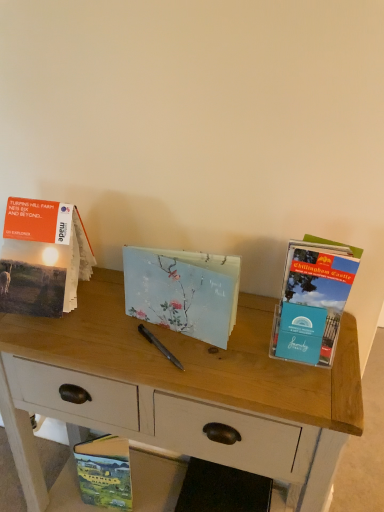
Question: From the image's perspective, is hardcover book at lower left, the 3th book from the right, over blue cardstock brochure at right, the fourth book from the left?

Choices:
 (A) yes
 (B) no

Answer: (B)

Question: From the image's perspective, would you say hardcover book at lower left, arranged as the 4th book when viewed from the top, is shown under blue cardstock brochure at right, which appears as the third book when viewed from the top?

Choices:
 (A) no
 (B) yes

Answer: (B)

Question: Considering the relative positions of hardcover book at lower left, the 3th book from the right, and blue cardstock brochure at right, which is counted as the first book, starting from the right, in the image provided, is hardcover book at lower left, the 3th book from the right, to the left of blue cardstock brochure at right, which is counted as the first book, starting from the right, from the viewer's perspective?

Choices:
 (A) yes
 (B) no

Answer: (A)

Question: Is hardcover book at lower left, which appears as the 2th book when viewed from the left, oriented away from blue cardstock brochure at right, which is counted as the first book, starting from the right?

Choices:
 (A) yes
 (B) no

Answer: (B)

Question: Does hardcover book at lower left, which appears as the 2th book when viewed from the left, have a smaller size compared to blue cardstock brochure at right, the fourth book from the left?

Choices:
 (A) yes
 (B) no

Answer: (A)

Question: Is hardcover book at lower left, arranged as the 4th book when viewed from the top, surrounding blue cardstock brochure at right, the fourth book from the left?

Choices:
 (A) yes
 (B) no

Answer: (B)

Question: Is hardcover book at lower left, the 3th book from the right, inside matte paper book at left, acting as the 4th book starting from the right?

Choices:
 (A) yes
 (B) no

Answer: (B)

Question: Is matte paper book at left, acting as the 4th book starting from the right, taller than hardcover book at lower left, the 3th book from the right?

Choices:
 (A) yes
 (B) no

Answer: (A)

Question: Is matte paper book at left, which appears as the fourth book when ordered from the bottom, closer to camera compared to hardcover book at lower left, which appears as the 2th book when viewed from the left?

Choices:
 (A) no
 (B) yes

Answer: (B)

Question: From a real-world perspective, is matte paper book at left, acting as the 4th book starting from the right, on hardcover book at lower left, which appears as the 2th book when viewed from the left?

Choices:
 (A) no
 (B) yes

Answer: (B)

Question: From the image's perspective, is matte paper book at left, acting as the 4th book starting from the right, on top of hardcover book at lower left, which is counted as the first book, starting from the bottom?

Choices:
 (A) yes
 (B) no

Answer: (A)

Question: From a real-world perspective, is matte paper book at left, which appears as the fourth book when ordered from the bottom, physically below hardcover book at lower left, which is counted as the first book, starting from the bottom?

Choices:
 (A) no
 (B) yes

Answer: (A)

Question: From the image's perspective, does wooden desk at center appear lower than hardcover book at lower left, the 3th book from the right?

Choices:
 (A) no
 (B) yes

Answer: (A)